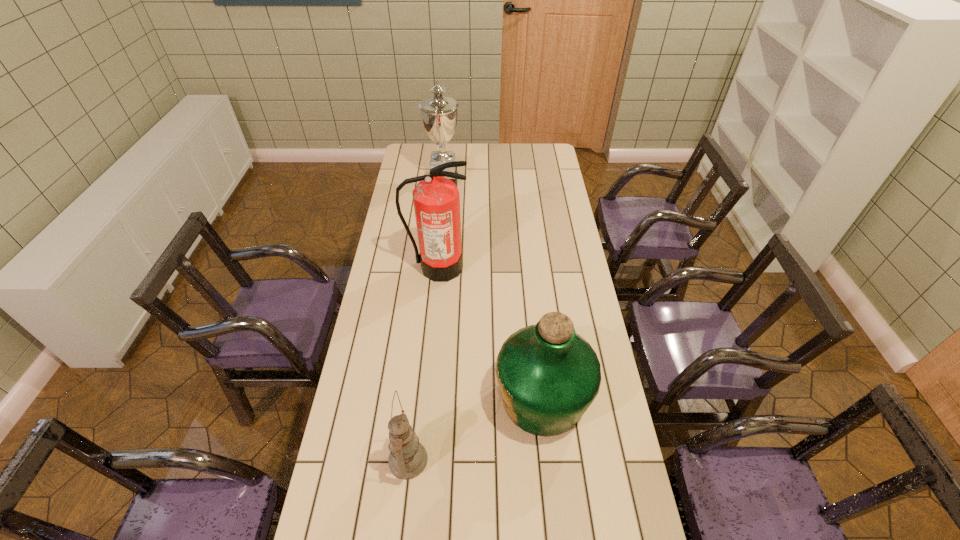
Image resolution: width=960 pixels, height=540 pixels. What are the coordinates of `empty space between the shortest object and the fire extinguisher` in the screenshot? It's located at (423, 363).

The height and width of the screenshot is (540, 960). Find the location of `free point between the liquor and the trophy cup`. free point between the liquor and the trophy cup is located at coordinates (493, 289).

Find the location of a particular element. free space that is in between the oil lamp and the fire extinguisher is located at coordinates (423, 363).

Identify the location of vacant space that is in between the shortest object and the fire extinguisher. This screenshot has height=540, width=960. (423, 363).

In order to click on vacant space that is in between the third nearest object and the oil lamp in this screenshot , I will do `click(423, 363)`.

Identify the location of free space between the oil lamp and the farthest object. The height and width of the screenshot is (540, 960). (426, 320).

The height and width of the screenshot is (540, 960). I want to click on empty space between the liquor and the third nearest object, so click(x=490, y=333).

Identify the location of free space that is in between the rightmost object and the third nearest object. The height and width of the screenshot is (540, 960). tap(490, 333).

Find the location of a particular element. the closest object to the fire extinguisher is located at coordinates (548, 375).

Where is `object that is the third nearest to the rightmost object`? object that is the third nearest to the rightmost object is located at coordinates (439, 113).